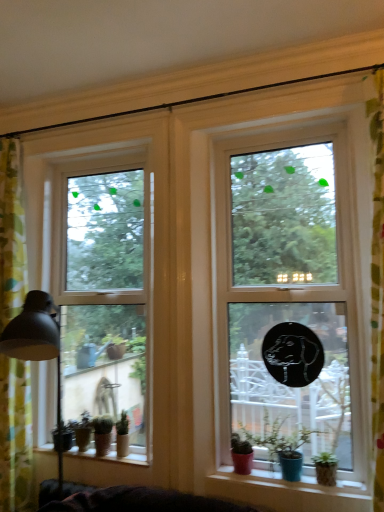
Question: Is clear glass window at left, which is the first window in back-to-front order, in front of or behind matte pink pot at lower center, the first houseplant positioned from the front, in the image?

Choices:
 (A) front
 (B) behind

Answer: (B)

Question: Is point (157, 394) closer or farther from the camera than point (276, 435)?

Choices:
 (A) farther
 (B) closer

Answer: (A)

Question: Which of these objects is positioned closest to the matte black lampshade at left?

Choices:
 (A) smooth wooden window sill at lower left, placed as the 2th window sill when sorted from front to back
 (B) clear glass window at left, positioned as the 1th window in left-to-right order
 (C) green matte houseplant at lower left, acting as the third houseplant starting from the back
 (D) transparent glass window at center, positioned as the 1th window in right-to-left order
 (E) matte pink pot at lower center, the 4th houseplant in the back-to-front sequence

Answer: (B)

Question: Estimate the real-world distances between objects in this image. Which object is farther from the matte black lampshade at left?

Choices:
 (A) green matte plant pot at lower left, the fourth houseplant positioned from the front
 (B) green matte houseplant at lower left, the 3th houseplant from the front
 (C) matte pink pot at lower center, the first houseplant positioned from the front
 (D) transparent glass window at center, which ranks as the 2th window in left-to-right order
 (E) matte ceramic pots at lower center, the first window sill from the front

Answer: (E)